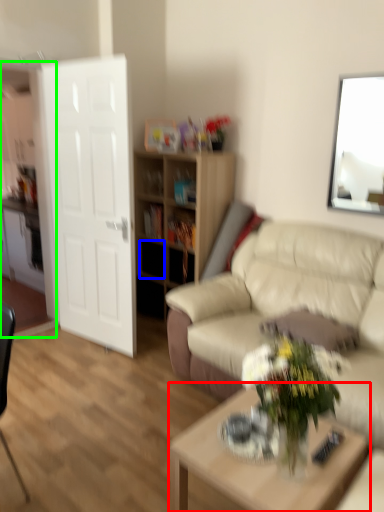
Question: Estimate the real-world distances between objects in this image. Which object is farther from coffee table (highlighted by a red box), drawer (highlighted by a blue box) or entertainment center (highlighted by a green box)?

Choices:
 (A) drawer
 (B) entertainment center

Answer: (B)